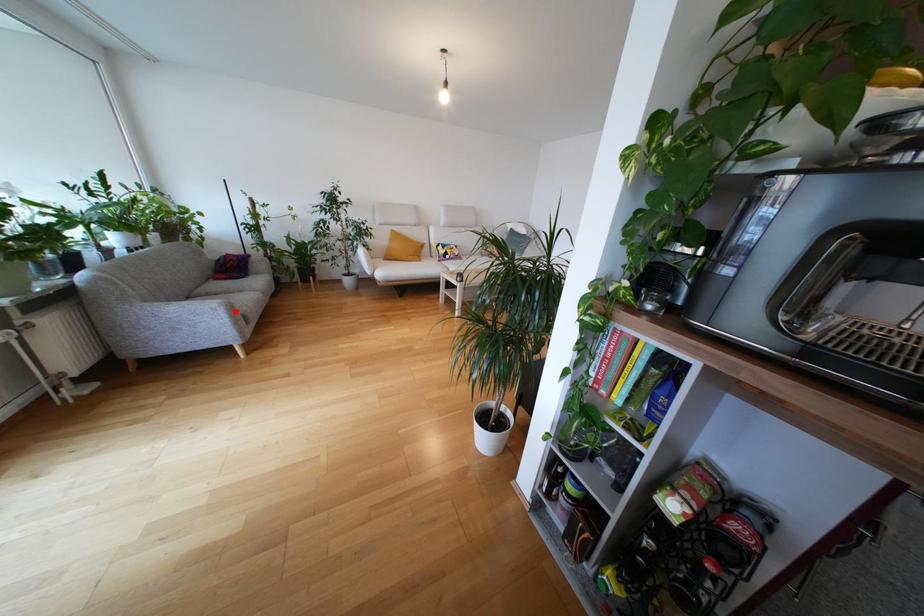
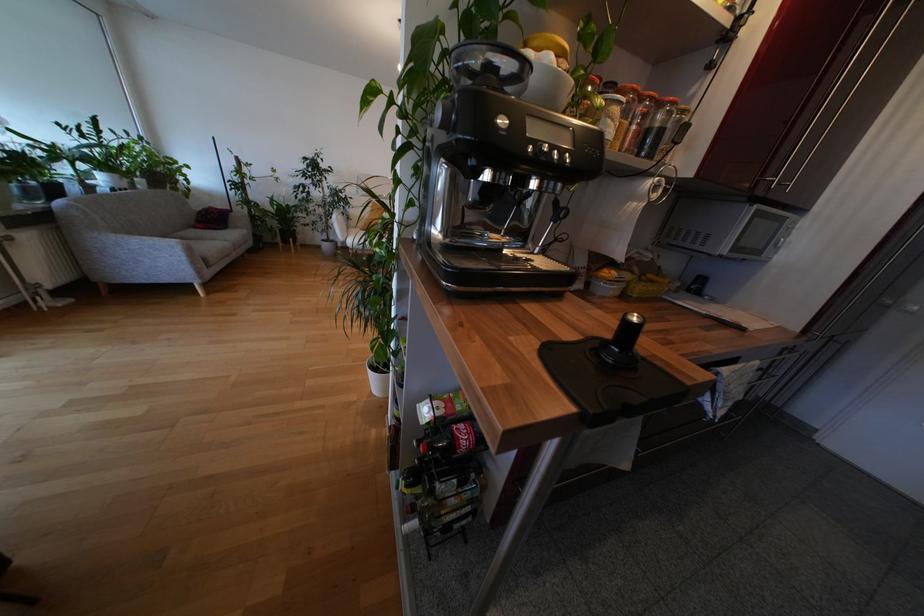
The point at the highlighted location is marked in the first image. Where is the corresponding point in the second image?

(192, 252)